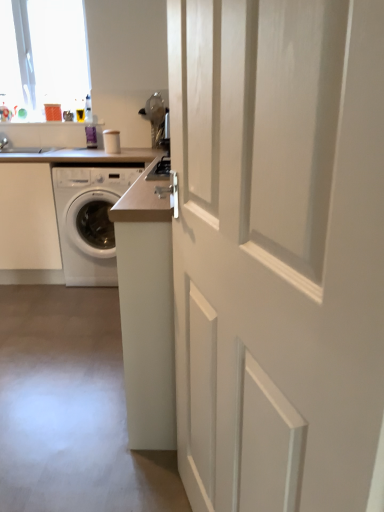
Question: From the image's perspective, is white glossy door at center under white laminate counter at center?

Choices:
 (A) yes
 (B) no

Answer: (A)

Question: Is white glossy door at center at the right side of white laminate counter at center?

Choices:
 (A) yes
 (B) no

Answer: (A)

Question: Is white glossy door at center at the left side of white laminate counter at center?

Choices:
 (A) yes
 (B) no

Answer: (B)

Question: Can you confirm if white glossy door at center is taller than white laminate counter at center?

Choices:
 (A) yes
 (B) no

Answer: (A)

Question: Is white glossy door at center closer to camera compared to white laminate counter at center?

Choices:
 (A) yes
 (B) no

Answer: (A)

Question: Considering the relative positions of white glossy door at center and white laminate counter at center in the image provided, is white glossy door at center to the left or to the right of white laminate counter at center?

Choices:
 (A) left
 (B) right

Answer: (B)

Question: Do you think white glossy door at center is within white laminate counter at center, or outside of it?

Choices:
 (A) inside
 (B) outside

Answer: (B)

Question: From a real-world perspective, relative to white laminate counter at center, is white glossy door at center vertically above or below?

Choices:
 (A) above
 (B) below

Answer: (A)

Question: Considering their positions, is white glossy door at center located in front of or behind white laminate counter at center?

Choices:
 (A) behind
 (B) front

Answer: (B)

Question: Do you think white glossy washing machine at left is within white glossy door at center, or outside of it?

Choices:
 (A) inside
 (B) outside

Answer: (B)

Question: Looking at the image, does white glossy washing machine at left seem bigger or smaller compared to white glossy door at center?

Choices:
 (A) big
 (B) small

Answer: (A)

Question: Visually, is white glossy washing machine at left positioned to the left or to the right of white glossy door at center?

Choices:
 (A) left
 (B) right

Answer: (A)

Question: From a real-world perspective, is white glossy washing machine at left positioned above or below white glossy door at center?

Choices:
 (A) above
 (B) below

Answer: (B)

Question: Do you think white glossy washing machine at left is within transparent glass window at upper left, or outside of it?

Choices:
 (A) outside
 (B) inside

Answer: (A)

Question: From the image's perspective, relative to transparent glass window at upper left, is white glossy washing machine at left above or below?

Choices:
 (A) below
 (B) above

Answer: (A)